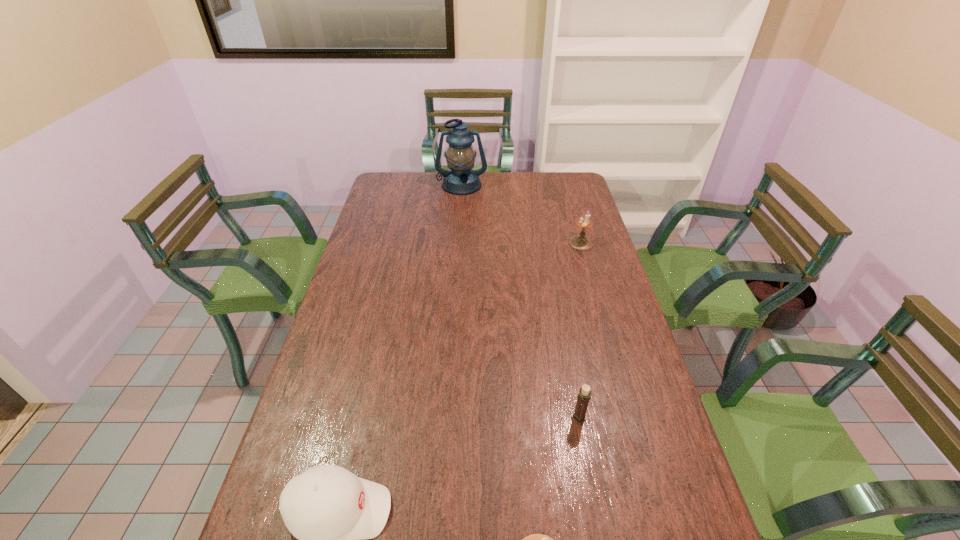
This screenshot has width=960, height=540. Find the location of `the farthest object`. the farthest object is located at coordinates (461, 179).

Locate an element on the screen. The image size is (960, 540). lantern is located at coordinates (461, 179).

Find the location of `the rightmost object`. the rightmost object is located at coordinates [x=579, y=242].

This screenshot has height=540, width=960. Find the location of `the farthest candle holder`. the farthest candle holder is located at coordinates (579, 242).

You are a GUI agent. You are given a task and a screenshot of the screen. Output one action in this format:
    pyautogui.click(x=<x>, y=<y>)
    Task: Click on the third farthest object
    The height and width of the screenshot is (540, 960).
    Given the screenshot: What is the action you would take?
    pyautogui.click(x=584, y=396)

At what (x,y) coordinates should I click in order to perform the action: click on the second object from right to left. Please return your answer as a coordinate pair (x, y). The image size is (960, 540). Looking at the image, I should click on (584, 396).

Find the location of a particular element. vacant space situated 0.190m on the face of the tallest object is located at coordinates (460, 219).

The height and width of the screenshot is (540, 960). In order to click on free region located on the left of the farthest candle holder in this screenshot , I will do `click(537, 243)`.

You are a GUI agent. You are given a task and a screenshot of the screen. Output one action in this format:
    pyautogui.click(x=<x>, y=<y>)
    Task: Click on the vacant space located on the left of the second farthest candle holder
    The image size is (960, 540).
    Given the screenshot: What is the action you would take?
    pyautogui.click(x=528, y=418)

What are the coordinates of `object that is positioned at the far edge` in the screenshot? It's located at (461, 179).